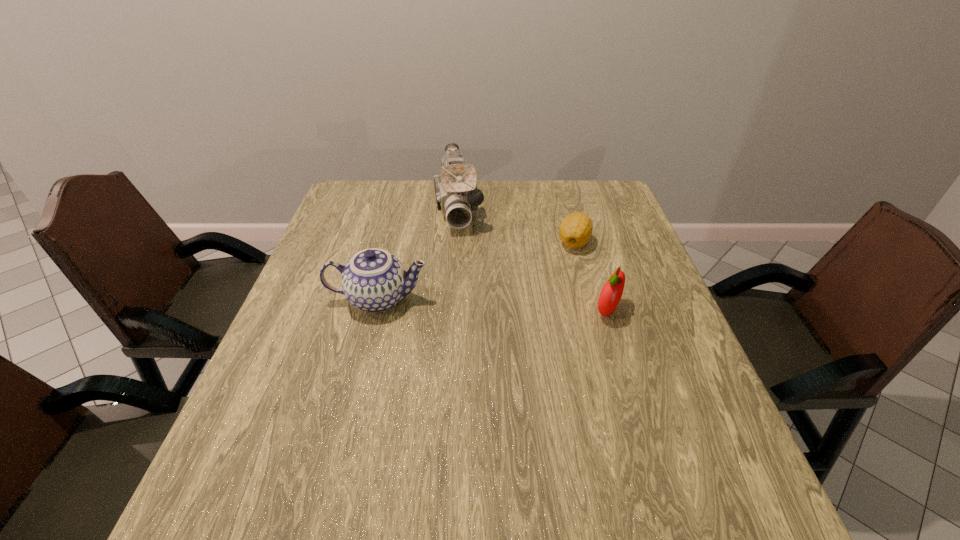
Identify the location of vacant space on the desktop that is between the chinaware and the apple and is positioned on the front-facing side of the tallest object. (472, 303).

At what (x,y) coordinates should I click in order to perform the action: click on vacant space on the desktop that is between the second tallest object and the apple and is positioned at the stem end of the lemon. Please return your answer as a coordinate pair (x, y). Looking at the image, I should click on (497, 305).